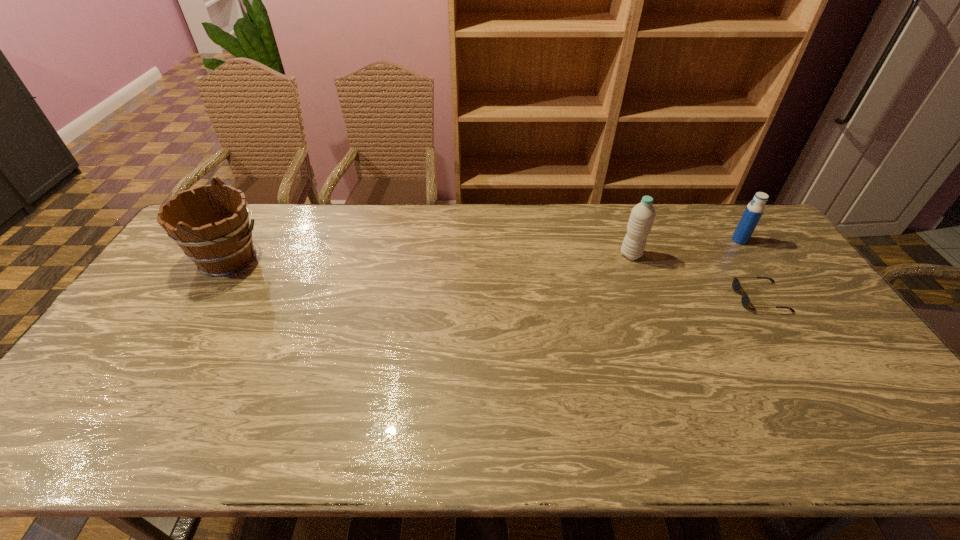
Where is `wine bucket`? wine bucket is located at coordinates (212, 227).

Locate an element on the screen. This screenshot has height=540, width=960. the nearer water bottle is located at coordinates (642, 216).

At what (x,y) coordinates should I click in order to perform the action: click on the taller water bottle. Please return your answer as a coordinate pair (x, y). Looking at the image, I should click on (642, 216).

Image resolution: width=960 pixels, height=540 pixels. I want to click on the right water bottle, so click(x=754, y=210).

Locate an element on the screen. The height and width of the screenshot is (540, 960). the farther water bottle is located at coordinates (754, 210).

The height and width of the screenshot is (540, 960). In order to click on the shortest object in this screenshot , I will do `click(736, 285)`.

The image size is (960, 540). In order to click on vacant point located with the handle on the leftmost object in this screenshot , I will do `click(317, 259)`.

Locate an element on the screen. This screenshot has height=540, width=960. vacant space located 0.290m on the front of the taller water bottle is located at coordinates (660, 333).

The height and width of the screenshot is (540, 960). In order to click on vacant position located on the left of the right water bottle in this screenshot , I will do `click(624, 240)`.

The width and height of the screenshot is (960, 540). In order to click on vacant space located on the front-facing side of the shortest object in this screenshot , I will do `click(612, 297)`.